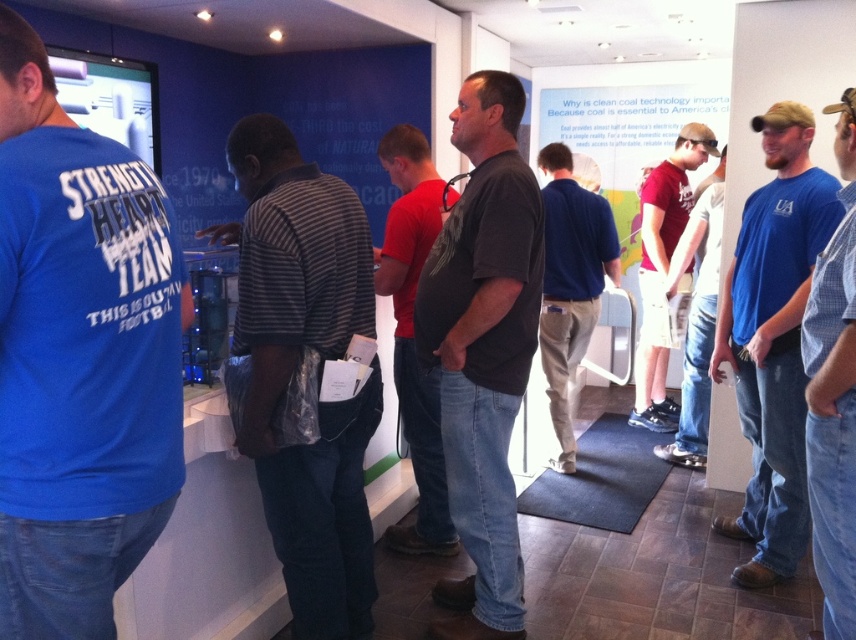
Question: Which point is closer to the camera taking this photo?

Choices:
 (A) (159, 426)
 (B) (354, 280)

Answer: (A)

Question: Among these points, which one is farthest from the camera?

Choices:
 (A) coord(9,300)
 (B) coord(424,321)
 (C) coord(762,317)

Answer: (C)

Question: In this image, where is striped cotton shirt at center located relative to white paperboard at center?

Choices:
 (A) right
 (B) left

Answer: (B)

Question: Based on their relative distances, which object is nearer to the matte red shirt at center?

Choices:
 (A) white paperboard at center
 (B) striped cotton shirt at center
 (C) blue matte shirt at left

Answer: (A)

Question: Is black matte shirt at center positioned in front of blue cotton shirt at center?

Choices:
 (A) yes
 (B) no

Answer: (A)

Question: Does striped cotton shirt at center have a smaller size compared to white paperboard at center?

Choices:
 (A) no
 (B) yes

Answer: (B)